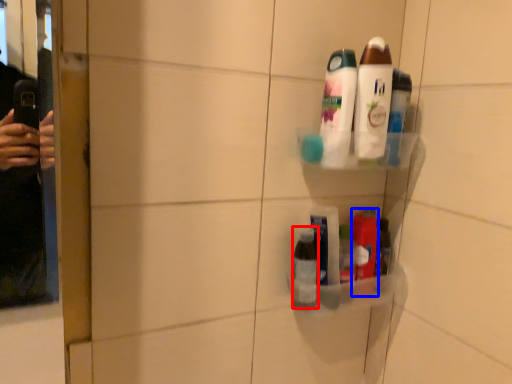
Question: Among these objects, which one is nearest to the camera, toiletry (highlighted by a red box) or toiletry (highlighted by a blue box)?

Choices:
 (A) toiletry
 (B) toiletry

Answer: (A)